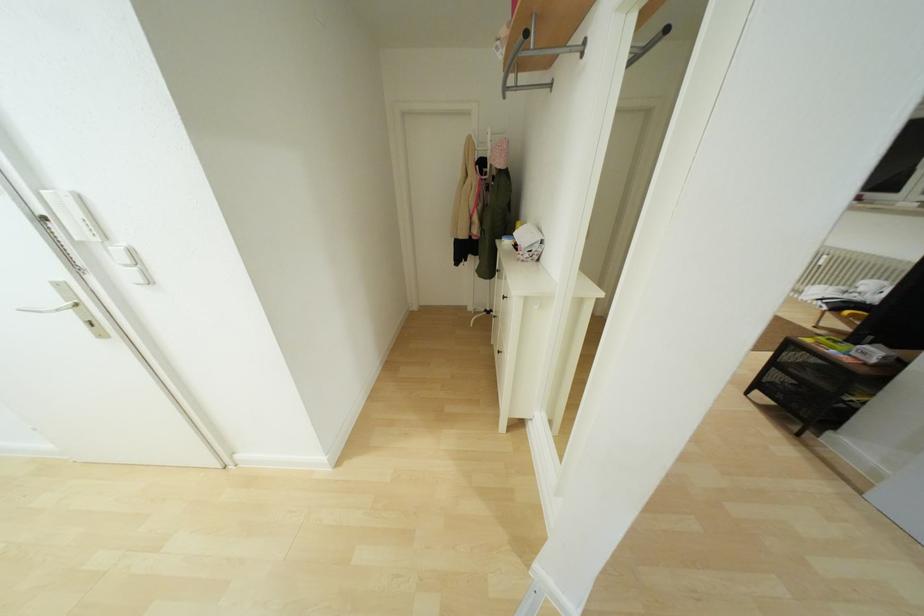
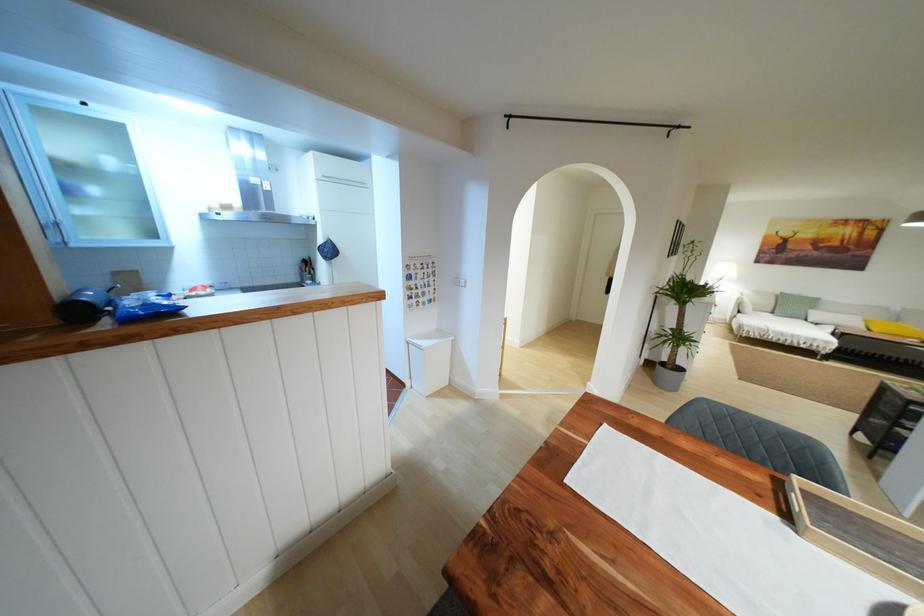
Question: I am providing you with two images of the same scene from different viewpoints. Which of the following objects are not visible in image2?

Choices:
 (A) black drawer knob
 (B) small drawer handle
 (C) white trash can lid
 (D) white door handle

Answer: (A)